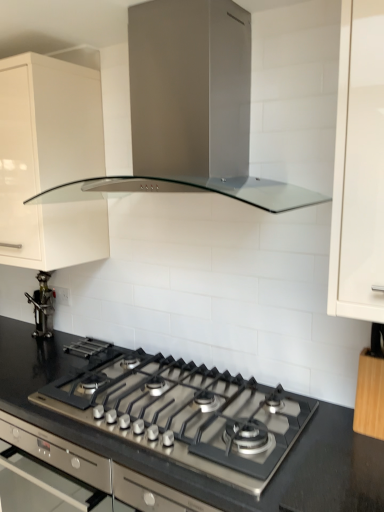
Question: Based on their positions, is white glossy cabinet at upper left, the first cabinetry from the left, located to the left or right of wooden knife block at right, the 1th cabinetry when ordered from bottom to top?

Choices:
 (A) left
 (B) right

Answer: (A)

Question: Considering their positions, is white glossy cabinet at upper left, the first cabinetry from the left, located in front of or behind wooden knife block at right, the 1th cabinetry positioned from the right?

Choices:
 (A) front
 (B) behind

Answer: (B)

Question: Which object is the farthest from the wooden knife block at right, the 1th cabinetry positioned from the right?

Choices:
 (A) black granite countertop at center
 (B) metallic figurine at left
 (C) white glossy cabinet at upper left, which appears as the first cabinetry when viewed from the back
 (D) satin silver range hood at upper center
 (E) satin silver oven at center

Answer: (B)

Question: Estimate the real-world distances between objects in this image. Which object is closer to the black granite countertop at center?

Choices:
 (A) metallic figurine at left
 (B) wooden knife block at right, arranged as the 2th cabinetry when viewed from the top
 (C) white glossy cabinet at upper left, which is the second cabinetry from front to back
 (D) satin silver range hood at upper center
 (E) satin silver oven at center

Answer: (E)